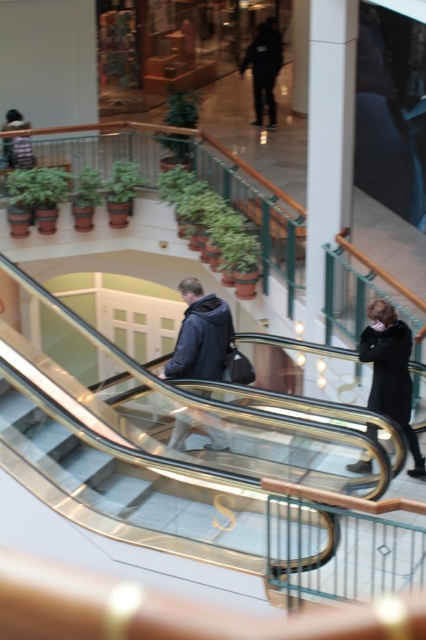
Question: In this image, where is transparent glass stairs at center located relative to dark blue jacket at center?

Choices:
 (A) left
 (B) right

Answer: (A)

Question: Observing the image, what is the correct spatial positioning of transparent glass stairs at center in reference to dark blue jacket at center?

Choices:
 (A) right
 (B) left

Answer: (B)

Question: Estimate the real-world distances between objects in this image. Which object is closer to the transparent glass stairs at center?

Choices:
 (A) black wool coat at lower right
 (B) dark blue jacket at center

Answer: (B)

Question: Which of the following is the closest to the observer?

Choices:
 (A) black wool coat at lower right
 (B) transparent glass stairs at center
 (C) dark blue jacket at center

Answer: (B)

Question: Which object is positioned closest to the transparent glass stairs at center?

Choices:
 (A) black wool coat at lower right
 (B) dark blue jacket at center

Answer: (B)

Question: In this image, where is dark blue jacket at center located relative to black wool coat at lower right?

Choices:
 (A) above
 (B) below

Answer: (A)